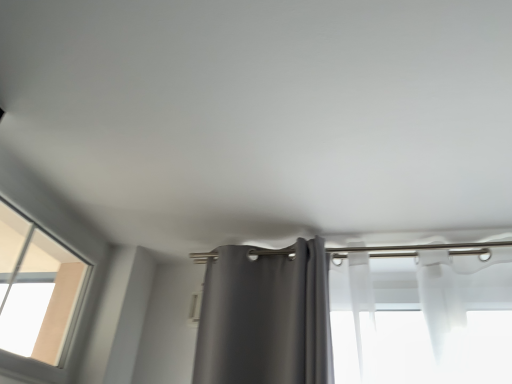
Image resolution: width=512 pixels, height=384 pixels. Describe the element at coordinates (37, 292) in the screenshot. I see `clear glass window at upper left` at that location.

Based on the photo, what is the approximate width of clear glass window at upper left?

clear glass window at upper left is 2.28 inches in width.

In order to face clear glass window at upper left, should I rotate leftwards or rightwards?

To face it directly, rotate left by 27.205 degrees.

Where is `clear glass window at upper left`? The height and width of the screenshot is (384, 512). clear glass window at upper left is located at coordinates (37, 292).

The width and height of the screenshot is (512, 384). Identify the location of clear glass window at upper left. (37, 292).